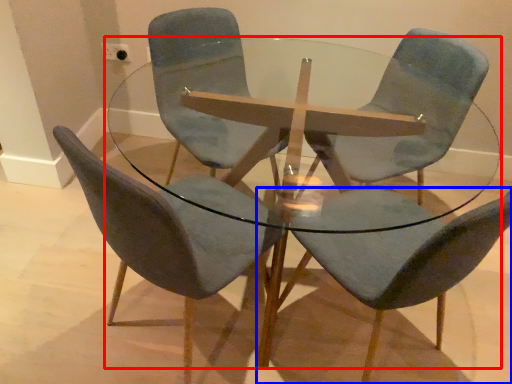
Question: Which object appears closest to the camera in this image, coffee table (highlighted by a red box) or chair (highlighted by a blue box)?

Choices:
 (A) coffee table
 (B) chair

Answer: (B)